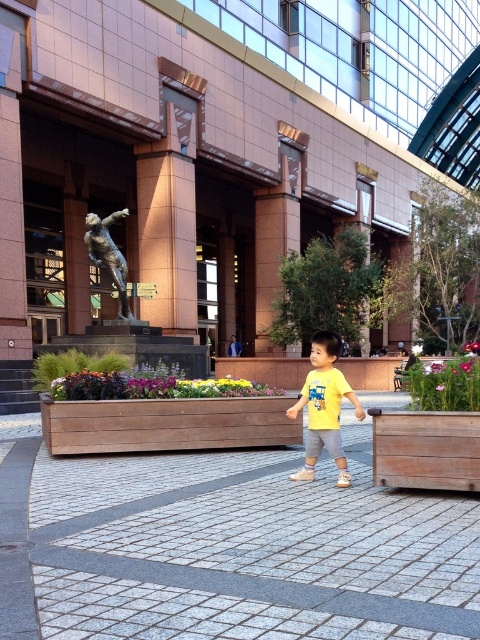
From the picture: Is brown stone mall at center behind bronze statue at center?

No, it is not.

Is point (326, 148) closer to viewer compared to point (126, 296)?

No, (326, 148) is further to viewer.

Where is `brown stone mall at center`? The width and height of the screenshot is (480, 640). brown stone mall at center is located at coordinates (202, 150).

Does gray concrete pavement at center have a larger size compared to sandy beige stone statue at upper center?

No.

The height and width of the screenshot is (640, 480). Identify the location of gray concrete pavement at center. (227, 547).

I want to click on gray concrete pavement at center, so point(227,547).

How distant is gray concrete pavement at center from yellow matte shirt at center?

A distance of 3.90 meters exists between gray concrete pavement at center and yellow matte shirt at center.

Is point (323, 563) positioned in front of point (338, 400)?

Yes, it is.

This screenshot has height=640, width=480. Identify the location of gray concrete pavement at center. (227, 547).